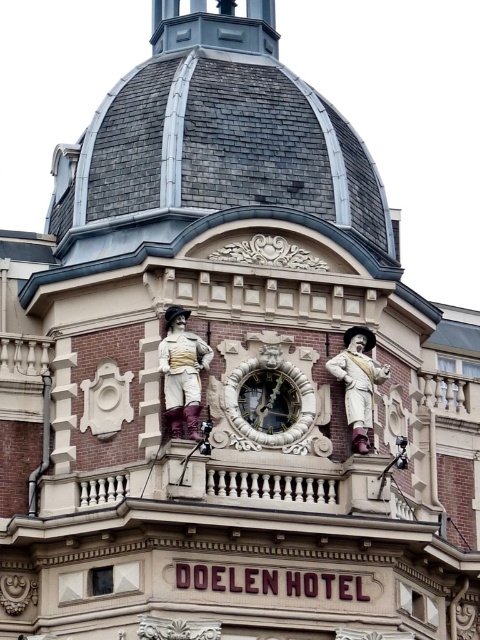
Question: Considering the real-world distances, which object is closest to the gold ornate clock at center?

Choices:
 (A) wooden statue at center
 (B) matte gold statue at center

Answer: (A)

Question: Which of the following is the farthest from the observer?

Choices:
 (A) (278, 368)
 (B) (177, 316)

Answer: (A)

Question: Can you confirm if gold ornate clock at center is positioned above wooden statue at center?

Choices:
 (A) no
 (B) yes

Answer: (A)

Question: Which point appears farthest from the camera in this image?

Choices:
 (A) (367, 445)
 (B) (305, 397)

Answer: (B)

Question: From the image, what is the correct spatial relationship of gold ornate clock at center in relation to matte gold statue at center?

Choices:
 (A) below
 (B) above

Answer: (A)

Question: Observing the image, what is the correct spatial positioning of gold ornate clock at center in reference to matte gold statue at center?

Choices:
 (A) right
 (B) left

Answer: (A)